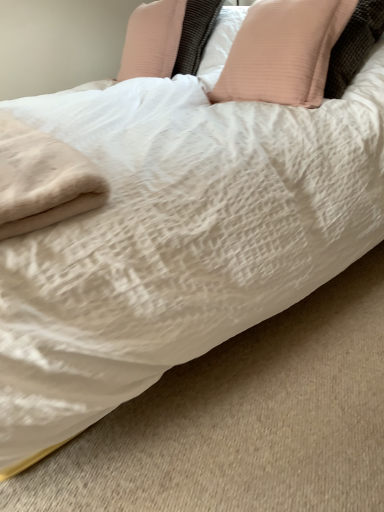
Image resolution: width=384 pixels, height=512 pixels. Describe the element at coordinates (283, 52) in the screenshot. I see `pale pink fabric pillow at upper right, marked as the 1th pillow in a right-to-left arrangement` at that location.

How much space does pale pink fabric pillow at upper right, which ranks as the 2th pillow in left-to-right order, occupy vertically?

It is 49.84 centimeters.

Locate an element on the screen. pale pink fabric pillow at upper right, which ranks as the 2th pillow in left-to-right order is located at coordinates (283, 52).

This screenshot has height=512, width=384. In order to click on pink ribbed pillow at upper center, acting as the second pillow starting from the right in this screenshot , I will do `click(168, 38)`.

This screenshot has height=512, width=384. What do you see at coordinates (168, 38) in the screenshot? I see `pink ribbed pillow at upper center, which ranks as the first pillow in left-to-right order` at bounding box center [168, 38].

This screenshot has width=384, height=512. Identify the location of pale pink fabric pillow at upper right, marked as the 1th pillow in a right-to-left arrangement. (283, 52).

Considering the relative positions of pink ribbed pillow at upper center, which ranks as the first pillow in left-to-right order, and pale pink fabric pillow at upper right, marked as the 1th pillow in a right-to-left arrangement, in the image provided, is pink ribbed pillow at upper center, which ranks as the first pillow in left-to-right order, to the left of pale pink fabric pillow at upper right, marked as the 1th pillow in a right-to-left arrangement, from the viewer's perspective?

Indeed, pink ribbed pillow at upper center, which ranks as the first pillow in left-to-right order, is positioned on the left side of pale pink fabric pillow at upper right, marked as the 1th pillow in a right-to-left arrangement.

Between pink ribbed pillow at upper center, which ranks as the first pillow in left-to-right order, and pale pink fabric pillow at upper right, which ranks as the 2th pillow in left-to-right order, which one is positioned in front?

pale pink fabric pillow at upper right, which ranks as the 2th pillow in left-to-right order, is in front.

Is point (190, 35) closer or farther from the camera than point (316, 100)?

Clearly, point (190, 35) is more distant from the camera than point (316, 100).

From the image's perspective, would you say pink ribbed pillow at upper center, which ranks as the first pillow in left-to-right order, is positioned over pale pink fabric pillow at upper right, which ranks as the 2th pillow in left-to-right order?

Yes, from the image's perspective, pink ribbed pillow at upper center, which ranks as the first pillow in left-to-right order, is above pale pink fabric pillow at upper right, which ranks as the 2th pillow in left-to-right order.

From a real-world perspective, between pink ribbed pillow at upper center, which ranks as the first pillow in left-to-right order, and pale pink fabric pillow at upper right, which ranks as the 2th pillow in left-to-right order, who is vertically higher?

From a 3D spatial view, pink ribbed pillow at upper center, which ranks as the first pillow in left-to-right order, is above.

Is pink ribbed pillow at upper center, acting as the second pillow starting from the right, wider than pale pink fabric pillow at upper right, which ranks as the 2th pillow in left-to-right order?

No.

Considering the sizes of objects pink ribbed pillow at upper center, which ranks as the first pillow in left-to-right order, and pale pink fabric pillow at upper right, marked as the 1th pillow in a right-to-left arrangement, in the image provided, who is shorter, pink ribbed pillow at upper center, which ranks as the first pillow in left-to-right order, or pale pink fabric pillow at upper right, marked as the 1th pillow in a right-to-left arrangement,?

With less height is pink ribbed pillow at upper center, which ranks as the first pillow in left-to-right order.

Does pink ribbed pillow at upper center, acting as the second pillow starting from the right, have a larger size compared to pale pink fabric pillow at upper right, which ranks as the 2th pillow in left-to-right order?

Actually, pink ribbed pillow at upper center, acting as the second pillow starting from the right, might be smaller than pale pink fabric pillow at upper right, which ranks as the 2th pillow in left-to-right order.

Is pale pink fabric pillow at upper right, which ranks as the 2th pillow in left-to-right order, inside pink ribbed pillow at upper center, which ranks as the first pillow in left-to-right order?

No, pale pink fabric pillow at upper right, which ranks as the 2th pillow in left-to-right order, is not a part of pink ribbed pillow at upper center, which ranks as the first pillow in left-to-right order.

Are pink ribbed pillow at upper center, acting as the second pillow starting from the right, and pale pink fabric pillow at upper right, which ranks as the 2th pillow in left-to-right order, beside each other?

No, pink ribbed pillow at upper center, acting as the second pillow starting from the right, is not in contact with pale pink fabric pillow at upper right, which ranks as the 2th pillow in left-to-right order.

Could you tell me if pink ribbed pillow at upper center, acting as the second pillow starting from the right, is facing pale pink fabric pillow at upper right, which ranks as the 2th pillow in left-to-right order?

No, pink ribbed pillow at upper center, acting as the second pillow starting from the right, is not aimed at pale pink fabric pillow at upper right, which ranks as the 2th pillow in left-to-right order.

How many degrees apart are the facing directions of pink ribbed pillow at upper center, which ranks as the first pillow in left-to-right order, and pale pink fabric pillow at upper right, which ranks as the 2th pillow in left-to-right order?

There is a 1.47-degree angle between the facing directions of pink ribbed pillow at upper center, which ranks as the first pillow in left-to-right order, and pale pink fabric pillow at upper right, which ranks as the 2th pillow in left-to-right order.

Measure the distance between pink ribbed pillow at upper center, which ranks as the first pillow in left-to-right order, and pale pink fabric pillow at upper right, marked as the 1th pillow in a right-to-left arrangement.

pink ribbed pillow at upper center, which ranks as the first pillow in left-to-right order, is 21.32 inches from pale pink fabric pillow at upper right, marked as the 1th pillow in a right-to-left arrangement.

This screenshot has height=512, width=384. Identify the location of pillow that appears on the right of pink ribbed pillow at upper center, which ranks as the first pillow in left-to-right order. (283, 52).

Which object is positioned more to the left, pale pink fabric pillow at upper right, marked as the 1th pillow in a right-to-left arrangement, or pink ribbed pillow at upper center, acting as the second pillow starting from the right?

pink ribbed pillow at upper center, acting as the second pillow starting from the right, is more to the left.

Considering their positions, is pale pink fabric pillow at upper right, marked as the 1th pillow in a right-to-left arrangement, located in front of or behind pink ribbed pillow at upper center, which ranks as the first pillow in left-to-right order?

pale pink fabric pillow at upper right, marked as the 1th pillow in a right-to-left arrangement, is in front of pink ribbed pillow at upper center, which ranks as the first pillow in left-to-right order.

Is point (319, 5) closer to camera compared to point (186, 47)?

Yes, it is in front of point (186, 47).

From the image's perspective, between pale pink fabric pillow at upper right, which ranks as the 2th pillow in left-to-right order, and pink ribbed pillow at upper center, acting as the second pillow starting from the right, which one is located above?

pink ribbed pillow at upper center, acting as the second pillow starting from the right, is shown above in the image.

From a real-world perspective, which is physically above, pale pink fabric pillow at upper right, which ranks as the 2th pillow in left-to-right order, or pink ribbed pillow at upper center, acting as the second pillow starting from the right?

pink ribbed pillow at upper center, acting as the second pillow starting from the right, is physically above.

Which of these two, pale pink fabric pillow at upper right, which ranks as the 2th pillow in left-to-right order, or pink ribbed pillow at upper center, which ranks as the first pillow in left-to-right order, is thinner?

pink ribbed pillow at upper center, which ranks as the first pillow in left-to-right order.

Can you confirm if pale pink fabric pillow at upper right, which ranks as the 2th pillow in left-to-right order, is taller than pink ribbed pillow at upper center, acting as the second pillow starting from the right?

Indeed, pale pink fabric pillow at upper right, which ranks as the 2th pillow in left-to-right order, has a greater height compared to pink ribbed pillow at upper center, acting as the second pillow starting from the right.

In the scene shown: Between pale pink fabric pillow at upper right, which ranks as the 2th pillow in left-to-right order, and pink ribbed pillow at upper center, which ranks as the first pillow in left-to-right order, which one has smaller size?

Smaller between the two is pink ribbed pillow at upper center, which ranks as the first pillow in left-to-right order.

Do you think pale pink fabric pillow at upper right, which ranks as the 2th pillow in left-to-right order, is within pink ribbed pillow at upper center, acting as the second pillow starting from the right, or outside of it?

pale pink fabric pillow at upper right, which ranks as the 2th pillow in left-to-right order, exists outside the volume of pink ribbed pillow at upper center, acting as the second pillow starting from the right.

Would you say pale pink fabric pillow at upper right, marked as the 1th pillow in a right-to-left arrangement, is a long distance from pink ribbed pillow at upper center, which ranks as the first pillow in left-to-right order?

Actually, pale pink fabric pillow at upper right, marked as the 1th pillow in a right-to-left arrangement, and pink ribbed pillow at upper center, which ranks as the first pillow in left-to-right order, are a little close together.

Is pale pink fabric pillow at upper right, which ranks as the 2th pillow in left-to-right order, oriented towards pink ribbed pillow at upper center, which ranks as the first pillow in left-to-right order?

No, pale pink fabric pillow at upper right, which ranks as the 2th pillow in left-to-right order, does not turn towards pink ribbed pillow at upper center, which ranks as the first pillow in left-to-right order.

How different are the orientations of pale pink fabric pillow at upper right, marked as the 1th pillow in a right-to-left arrangement, and pink ribbed pillow at upper center, acting as the second pillow starting from the right, in degrees?

1.47 degrees separate the facing orientations of pale pink fabric pillow at upper right, marked as the 1th pillow in a right-to-left arrangement, and pink ribbed pillow at upper center, acting as the second pillow starting from the right.

In the image, there is a pink ribbed pillow at upper center, acting as the second pillow starting from the right. At what (x,y) coordinates should I click in order to perform the action: click on pillow below it (from the image's perspective). Please return your answer as a coordinate pair (x, y). The width and height of the screenshot is (384, 512). Looking at the image, I should click on (283, 52).

Find the location of a particular element. pillow that is above the pale pink fabric pillow at upper right, marked as the 1th pillow in a right-to-left arrangement (from the image's perspective) is located at coordinates (168, 38).

At what (x,y) coordinates should I click in order to perform the action: click on pillow that appears above the pale pink fabric pillow at upper right, marked as the 1th pillow in a right-to-left arrangement (from a real-world perspective). Please return your answer as a coordinate pair (x, y). Looking at the image, I should click on (168, 38).